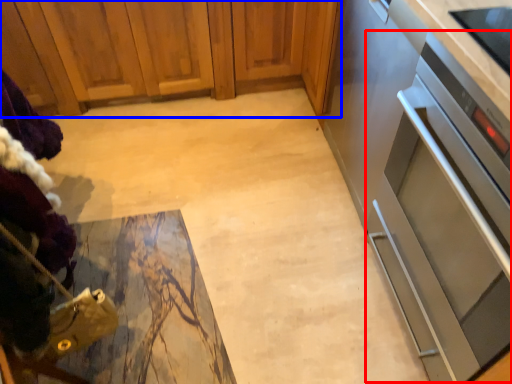
Question: Which object appears farthest to the camera in this image, oven (highlighted by a red box) or cabinetry (highlighted by a blue box)?

Choices:
 (A) oven
 (B) cabinetry

Answer: (B)